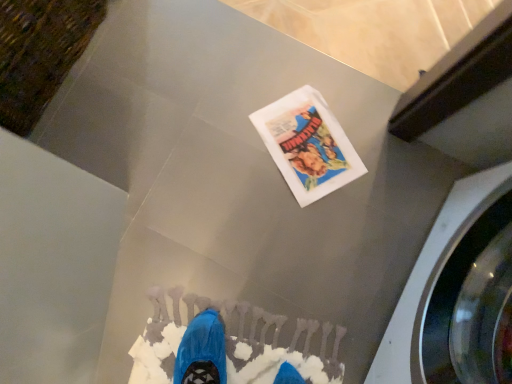
Question: In the image, is metallic gray washing machine at right on the left side or the right side of white paper flyer at center?

Choices:
 (A) left
 (B) right

Answer: (B)

Question: From a real-world perspective, is metallic gray washing machine at right physically located above or below white paper flyer at center?

Choices:
 (A) above
 (B) below

Answer: (A)

Question: In the image, is metallic gray washing machine at right positioned in front of or behind white paper flyer at center?

Choices:
 (A) behind
 (B) front

Answer: (B)

Question: From their relative heights in the image, would you say white paper flyer at center is taller or shorter than metallic gray washing machine at right?

Choices:
 (A) tall
 (B) short

Answer: (B)

Question: Would you say white paper flyer at center is to the left or to the right of metallic gray washing machine at right in the picture?

Choices:
 (A) right
 (B) left

Answer: (B)

Question: Looking at the image, does white paper flyer at center seem bigger or smaller compared to metallic gray washing machine at right?

Choices:
 (A) big
 (B) small

Answer: (B)

Question: From a real-world perspective, is white paper flyer at center physically located above or below metallic gray washing machine at right?

Choices:
 (A) below
 (B) above

Answer: (A)